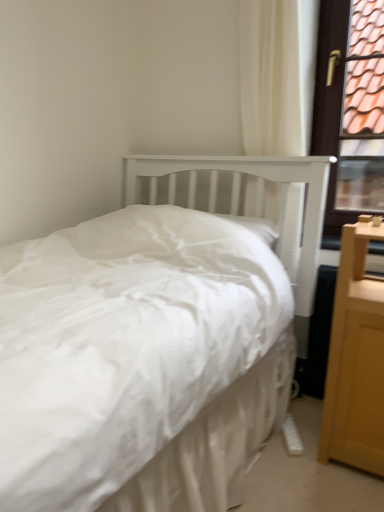
Locate an element on the screen. The width and height of the screenshot is (384, 512). vacant space to the left of light wood nightstand at right is located at coordinates (292, 461).